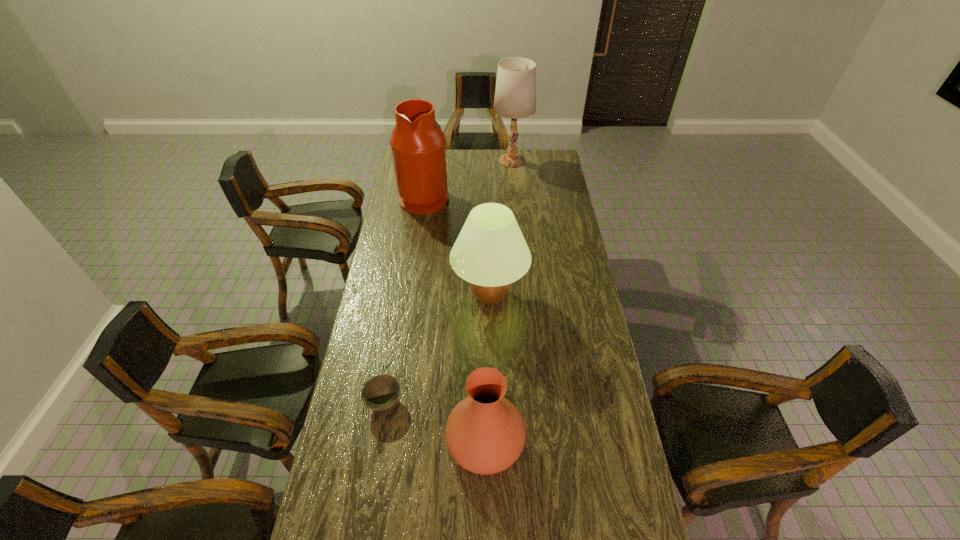
I want to click on lamp, so click(x=515, y=95).

At what (x,y) coordinates should I click in order to perform the action: click on water jug. Please return your answer as a coordinate pair (x, y). The height and width of the screenshot is (540, 960). Looking at the image, I should click on (417, 142).

I want to click on the third shortest object, so click(x=490, y=252).

The width and height of the screenshot is (960, 540). What are the coordinates of `lampshade` in the screenshot? It's located at (490, 252).

In order to click on vase in this screenshot , I will do `click(485, 433)`.

Identify the location of bowl. This screenshot has height=540, width=960. (381, 392).

You are a GUI agent. You are given a task and a screenshot of the screen. Output one action in this format:
    pyautogui.click(x=<x>, y=<y>)
    Task: Click on the free space located 0.340m on the front of the lamp
    
    Given the screenshot: What is the action you would take?
    pyautogui.click(x=516, y=209)

I want to click on blank space located 0.300m from the spout of the water jug, so click(x=507, y=197).

Where is `free space located 0.360m on the shade of the third shortest object`? The width and height of the screenshot is (960, 540). free space located 0.360m on the shade of the third shortest object is located at coordinates (492, 410).

At what (x,y) coordinates should I click in order to perform the action: click on free space located 0.260m on the right of the fourth tallest object. Please return your answer as a coordinate pair (x, y). Image resolution: width=960 pixels, height=540 pixels. Looking at the image, I should click on (607, 442).